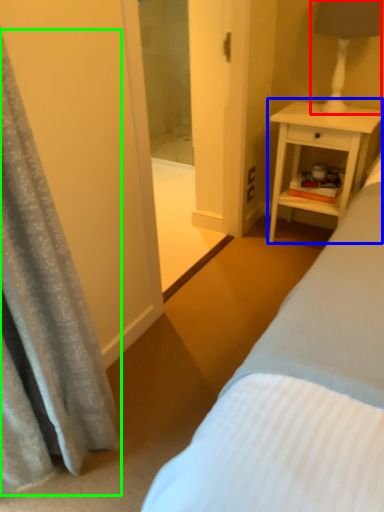
Question: Which object is the closest to the bedside lamp (highlighted by a red box)? Choose among these: nightstand (highlighted by a blue box) or curtain (highlighted by a green box).

Choices:
 (A) nightstand
 (B) curtain

Answer: (A)